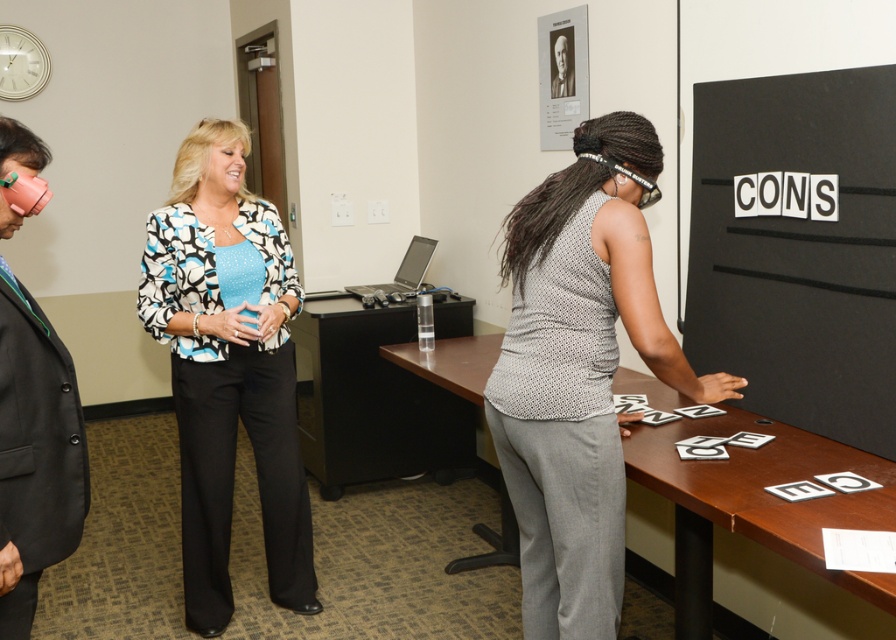
Question: Which object appears farthest from the camera in this image?

Choices:
 (A) printed fabric blouse at center
 (B) gray textured shirt at center
 (C) brown wooden table at center
 (D) black matte board at right

Answer: (A)

Question: Is gray textured shirt at center closer to the viewer compared to brown wooden table at center?

Choices:
 (A) yes
 (B) no

Answer: (B)

Question: Which object is closer to the camera taking this photo?

Choices:
 (A) black wood table at center
 (B) printed fabric blouse at center
 (C) brown wooden table at center

Answer: (C)

Question: Where is gray textured shirt at center located in relation to black suit at left in the image?

Choices:
 (A) below
 (B) above

Answer: (A)

Question: Can you confirm if gray textured shirt at center is positioned to the right of printed fabric blouse at center?

Choices:
 (A) yes
 (B) no

Answer: (A)

Question: Which of the following is the farthest from the observer?

Choices:
 (A) brown wooden table at center
 (B) black matte board at right
 (C) gray textured shirt at center

Answer: (B)